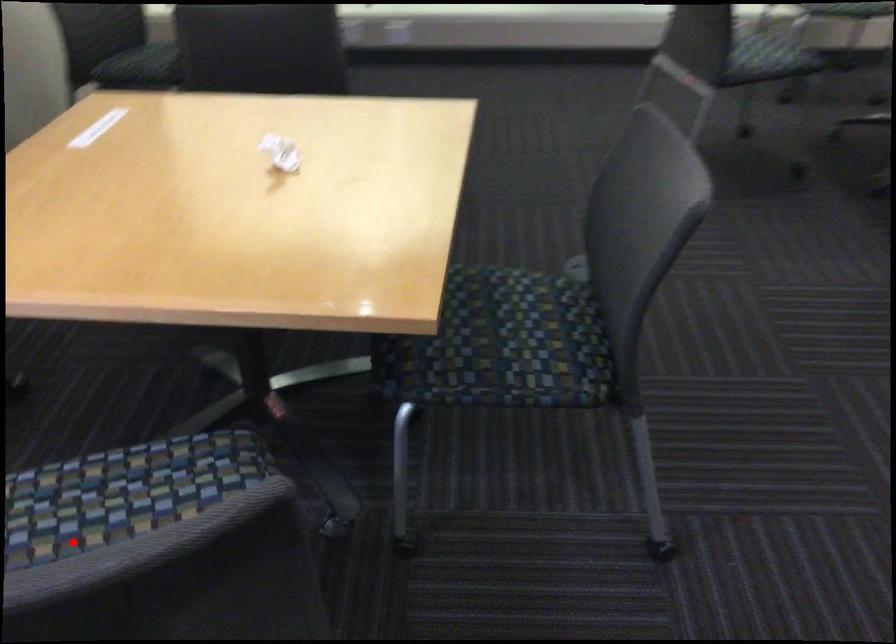
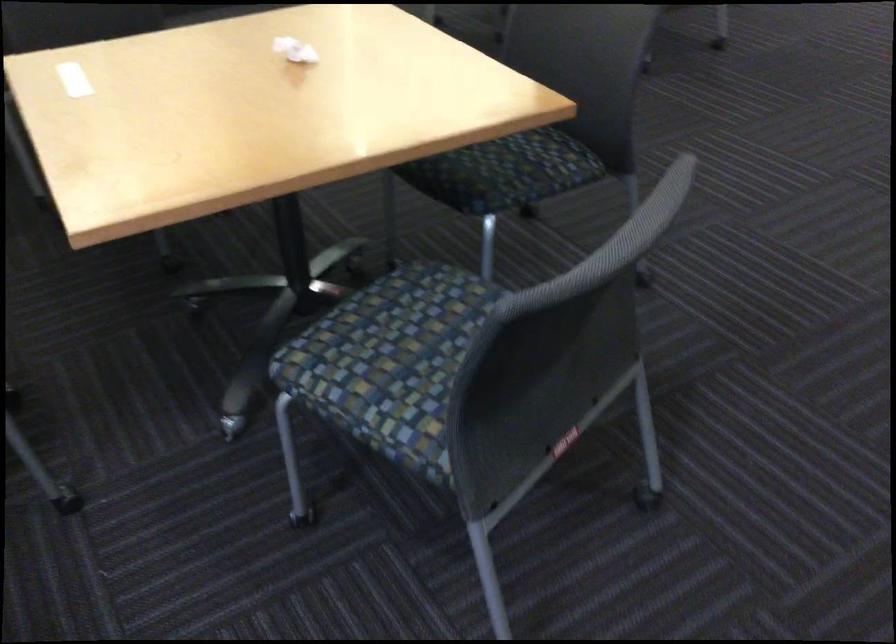
Question: I am providing you with two images of the same scene from different viewpoints. In image1, a red point is highlighted. Considering the same 3D point in image2, which of the following is correct?

Choices:
 (A) It is closer
 (B) It is farther

Answer: (B)